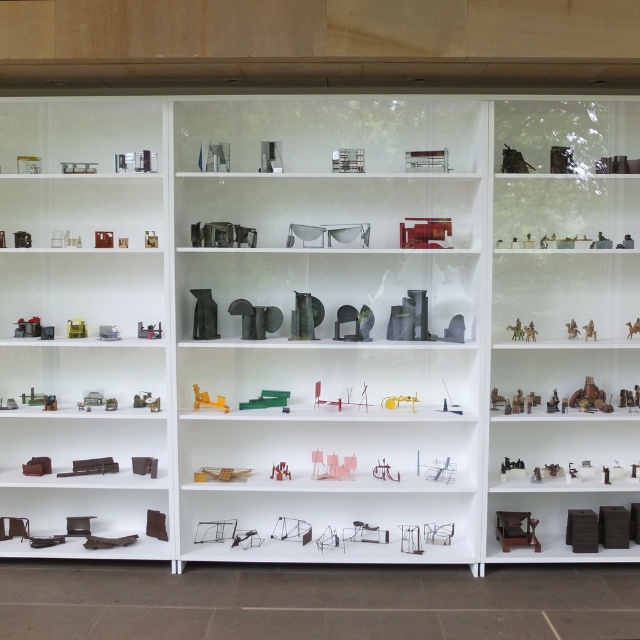
You are an interior designer arranging items on a shelf. You have the metallic sculpture at center and the metallic red toy airplane at center. Which object should you place on the higher shelf if you want to follow the rule of arranging larger items above smaller ones?

You should place the metallic sculpture at center on the higher shelf because it is larger than the metallic red toy airplane at center.

You are standing in front of the shelving units and notice two points marked on the shelves. The first point is at coordinates point (150, 147) and the second is at point (358, 301). Which point is closer to your eyes?

Point (150, 147) is closer to the camera than point (358, 301), so the first point is closer to your eyes.

You are an interior designer looking to place a new item on the shelf. You have the brown matte furniture at lower left and the metallic sculpture at center in view. Which object would block the view of the other if you place a new item in between them?

The brown matte furniture at lower left is in front of the metallic sculpture at center. Placing a new item between them would block the view of the metallic sculpture at center first since it is behind the brown matte furniture at lower left.